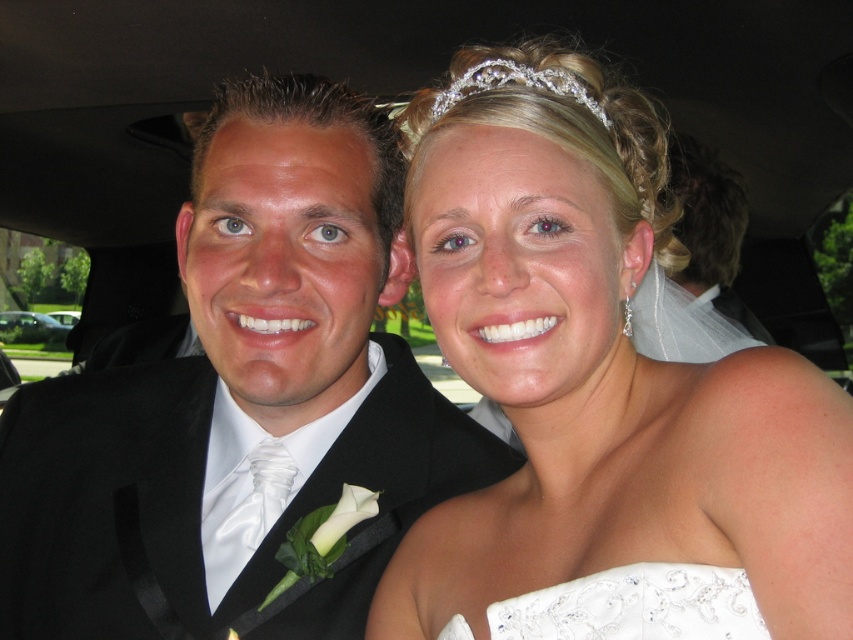
Question: Can you confirm if white satin dress at upper right is bigger than black satin tuxedo at left?

Choices:
 (A) yes
 (B) no

Answer: (A)

Question: From the image, what is the correct spatial relationship of white satin dress at upper right in relation to black satin tuxedo at left?

Choices:
 (A) below
 (B) above

Answer: (B)

Question: Is white satin dress at upper right below black satin tuxedo at left?

Choices:
 (A) no
 (B) yes

Answer: (A)

Question: Considering the real-world distances, which object is closest to the clear crystal tiara at upper center?

Choices:
 (A) white satin dress at upper right
 (B) white satin wedding dress at center

Answer: (A)

Question: Which of the following is the closest to the observer?

Choices:
 (A) (242, 225)
 (B) (550, 260)

Answer: (B)

Question: Which object appears farthest from the camera in this image?

Choices:
 (A) clear crystal tiara at upper center
 (B) white satin dress at upper right

Answer: (A)